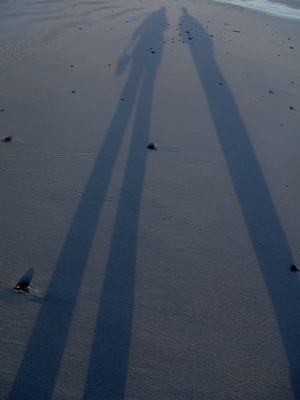
You are a GUI agent. You are given a task and a screenshot of the screen. Output one action in this format:
    pyautogui.click(x=<x>, y=<y>)
    Task: Click on the corner
    The height and width of the screenshot is (400, 300).
    Given the screenshot: What is the action you would take?
    pyautogui.click(x=293, y=393), pyautogui.click(x=7, y=392), pyautogui.click(x=8, y=15), pyautogui.click(x=295, y=4)